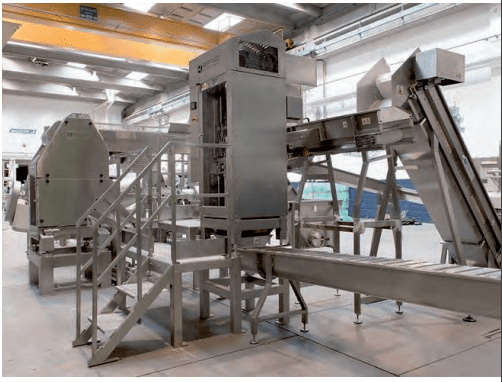
This screenshot has width=502, height=382. I want to click on visible sky lights, so click(220, 22), click(138, 4), click(133, 74), click(77, 65), click(110, 92).